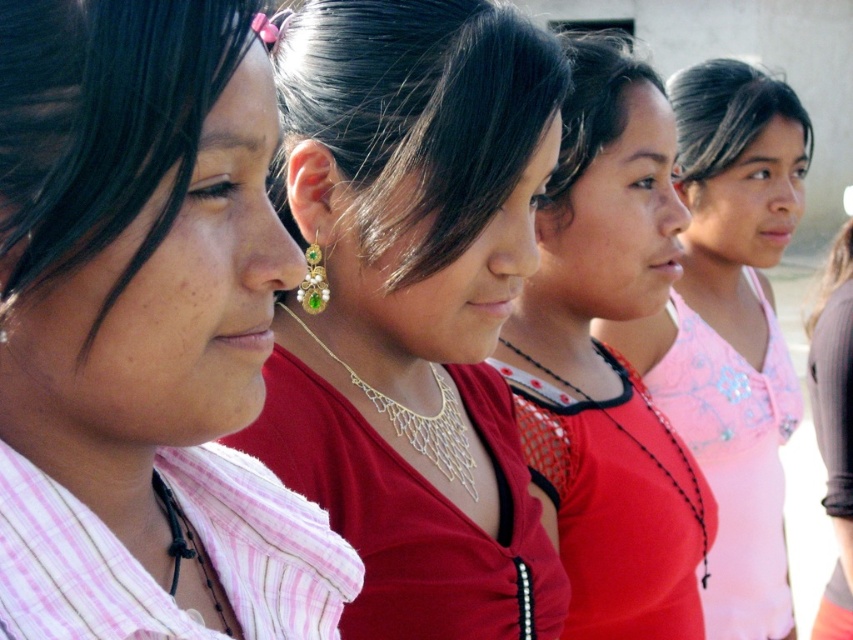
You are a photographer adjusting the lighting for a portrait. You notice the gold mesh necklace at center and the matte red blouse at center. Which object is closer to the camera?

The matte red blouse at center is closer to the camera because the gold mesh necklace at center is positioned behind it.

You are a photographer trying to capture the group of women in the scene. You notice a point at coordinates (608, 358). What object is located at this point?

The point at coordinates (608, 358) corresponds to the matte red blouse at center.